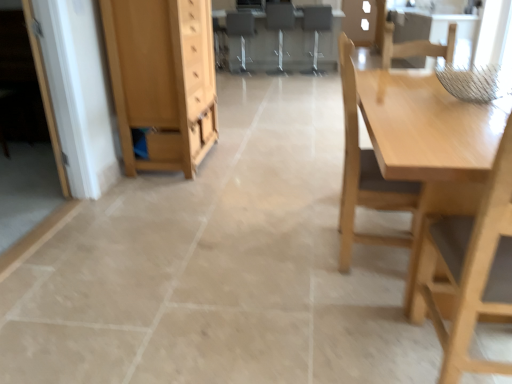
Question: Is matte gray computer desk at center to the left of light brown wooden chair at upper right, the second chair positioned from the front, from the viewer's perspective?

Choices:
 (A) no
 (B) yes

Answer: (B)

Question: Can you confirm if matte gray computer desk at center is positioned to the right of light brown wooden chair at upper right, which ranks as the 1th chair in right-to-left order?

Choices:
 (A) no
 (B) yes

Answer: (A)

Question: From a real-world perspective, is matte gray computer desk at center positioned over light brown wooden chair at upper right, which ranks as the 1th chair in right-to-left order, based on gravity?

Choices:
 (A) yes
 (B) no

Answer: (B)

Question: Is matte gray computer desk at center looking in the opposite direction of light brown wooden chair at upper right, which ranks as the 1th chair in right-to-left order?

Choices:
 (A) yes
 (B) no

Answer: (B)

Question: Is matte gray computer desk at center surrounding light brown wooden chair at upper right, the second chair positioned from the front?

Choices:
 (A) yes
 (B) no

Answer: (B)

Question: Looking at the image, does metallic gray chair at center, which is the fifth chair from right to left, seem bigger or smaller compared to light wood cabinet at left?

Choices:
 (A) small
 (B) big

Answer: (A)

Question: Considering the relative positions of metallic gray chair at center, positioned as the fifth chair in front-to-back order, and light wood cabinet at left in the image provided, is metallic gray chair at center, positioned as the fifth chair in front-to-back order, to the left or to the right of light wood cabinet at left?

Choices:
 (A) left
 (B) right

Answer: (B)

Question: Does point (245, 23) appear closer or farther from the camera than point (159, 105)?

Choices:
 (A) farther
 (B) closer

Answer: (A)

Question: Is metallic gray chair at center, which is the fifth chair from right to left, wider or thinner than light wood cabinet at left?

Choices:
 (A) thin
 (B) wide

Answer: (A)

Question: Is light wood table at right wider or thinner than light wood cabinet at left?

Choices:
 (A) wide
 (B) thin

Answer: (A)

Question: Based on their positions, is light wood table at right located to the left or right of light wood cabinet at left?

Choices:
 (A) right
 (B) left

Answer: (A)

Question: From the image's perspective, is light wood table at right located above or below light wood cabinet at left?

Choices:
 (A) below
 (B) above

Answer: (A)

Question: Is point (x=365, y=112) positioned closer to the camera than point (x=147, y=92)?

Choices:
 (A) closer
 (B) farther

Answer: (A)

Question: Considering the positions of light wood cabinet at left and wooden chair at center, which is the 3th chair from back to front, in the image, is light wood cabinet at left taller or shorter than wooden chair at center, which is the 3th chair from back to front,?

Choices:
 (A) short
 (B) tall

Answer: (B)

Question: Would you say light wood cabinet at left is inside or outside wooden chair at center, which is the 3th chair from front to back?

Choices:
 (A) inside
 (B) outside

Answer: (B)